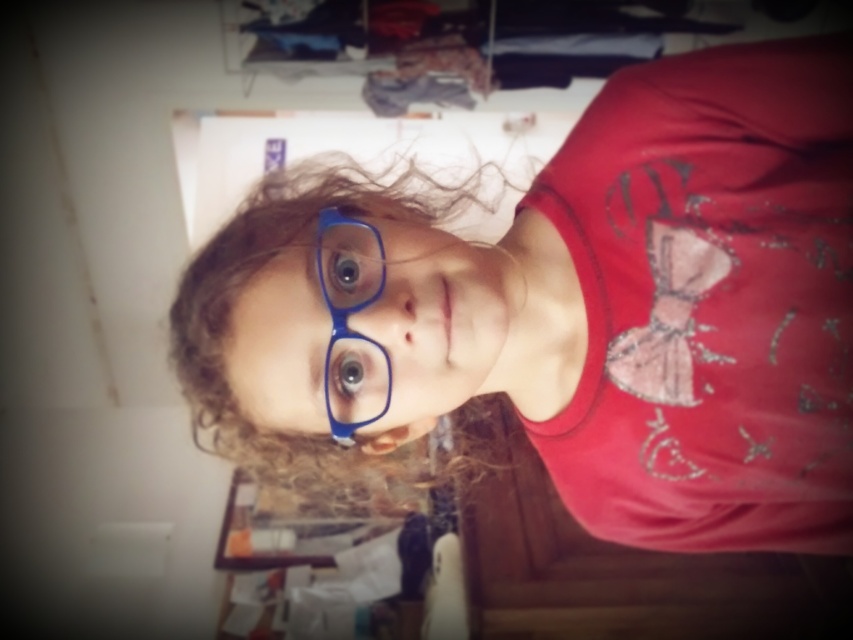
Question: Can you confirm if matte blue glasses at center is thinner than blue glossy eye at center?

Choices:
 (A) no
 (B) yes

Answer: (A)

Question: Which of these objects is positioned farthest from the curly brown hair at center?

Choices:
 (A) matte blue glasses at center
 (B) blue glossy eye at center

Answer: (B)

Question: Based on their relative distances, which object is nearer to the curly brown hair at center?

Choices:
 (A) blue plastic glasses at center
 (B) blue glossy eye at center
 (C) matte blue glasses at center

Answer: (C)

Question: Does curly brown hair at center lie in front of blue glassy eye at center?

Choices:
 (A) no
 (B) yes

Answer: (B)

Question: Which of the following is the closest to the observer?

Choices:
 (A) (448, 486)
 (B) (340, 288)

Answer: (B)

Question: Is curly brown hair at center smaller than blue plastic glasses at center?

Choices:
 (A) yes
 (B) no

Answer: (B)